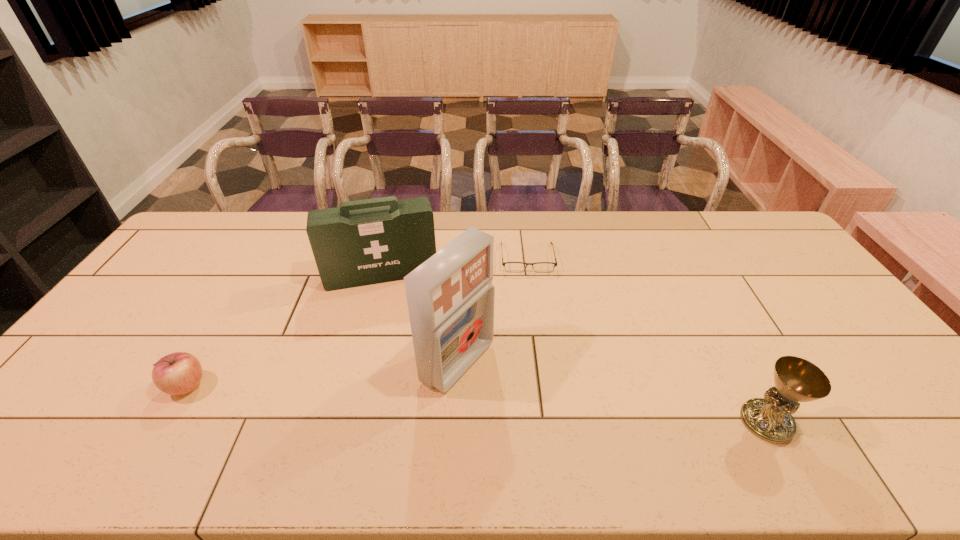
Identify the location of apple. The image size is (960, 540). (178, 373).

I want to click on the leftmost object, so click(x=178, y=373).

Where is `chalice`? chalice is located at coordinates (796, 380).

The image size is (960, 540). In order to click on the third shortest object in this screenshot , I will do `click(796, 380)`.

Where is `the farther first-aid kit`? This screenshot has width=960, height=540. the farther first-aid kit is located at coordinates (364, 242).

I want to click on the shorter first-aid kit, so [x=364, y=242].

Where is `the fourth object from left to right`? The image size is (960, 540). the fourth object from left to right is located at coordinates (542, 267).

Find the location of `spectacles`. spectacles is located at coordinates (542, 267).

Identify the location of the taller first-aid kit. (450, 296).

This screenshot has height=540, width=960. Identify the location of the nearer first-aid kit. (450, 296).